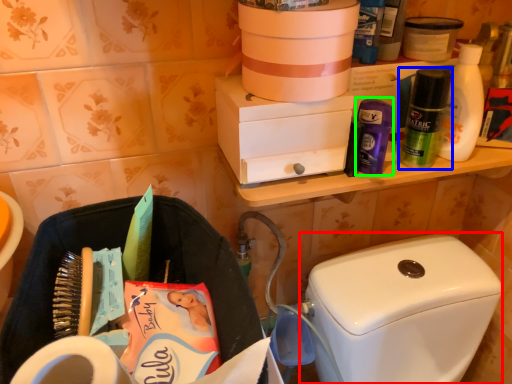
Question: Which object is the closest to the washer (highlighted by a red box)? Choose among these: toiletry (highlighted by a blue box) or toiletry (highlighted by a green box).

Choices:
 (A) toiletry
 (B) toiletry

Answer: (A)